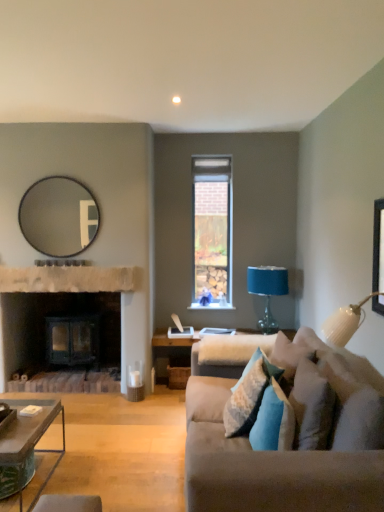
Where is `fur-like fabric ottoman at lower center`? fur-like fabric ottoman at lower center is located at coordinates (212, 353).

At what (x,y) coordinates should I click in order to perform the action: click on matte black mirror at upper left. Please return your answer as a coordinate pair (x, y). The width and height of the screenshot is (384, 512). Looking at the image, I should click on (59, 216).

The width and height of the screenshot is (384, 512). Describe the element at coordinates (212, 231) in the screenshot. I see `brick textured window at center` at that location.

Where is `textured blue pillow at center, arranged as the third pillow when viewed from the front`? textured blue pillow at center, arranged as the third pillow when viewed from the front is located at coordinates (248, 395).

What do you see at coordinates (248, 395) in the screenshot?
I see `textured blue pillow at center, arranged as the third pillow when viewed from the front` at bounding box center [248, 395].

Describe the element at coordinates (264, 367) in the screenshot. The image size is (384, 512). I see `blue textured pillow at center, positioned as the fourth pillow in front-to-back order` at that location.

What is the approximate height of black matte picture frame at upper right?

26.23 inches.

Describe the element at coordinates (31, 447) in the screenshot. I see `green textured coffee table at lower left` at that location.

The height and width of the screenshot is (512, 384). Find the location of `fur-like fabric ottoman at lower center`. fur-like fabric ottoman at lower center is located at coordinates (212, 353).

From the image's perspective, would you say blue velvet pillow at lower right, the 3th pillow from the back, is shown under black matte picture frame at upper right?

Indeed, from the image's perspective, blue velvet pillow at lower right, the 3th pillow from the back, is shown beneath black matte picture frame at upper right.

Locate an element on the screen. The width and height of the screenshot is (384, 512). picture frame located above the blue velvet pillow at lower right, which appears as the 2th pillow when viewed from the front (from the image's perspective) is located at coordinates (378, 246).

Is blue velvet pillow at lower right, the 3th pillow from the back, aimed at black matte picture frame at upper right?

No, blue velvet pillow at lower right, the 3th pillow from the back, is not aimed at black matte picture frame at upper right.

Is blue velvet pillow at lower right, the 3th pillow from the back, taller or shorter than black matte picture frame at upper right?

In the image, blue velvet pillow at lower right, the 3th pillow from the back, appears to be shorter than black matte picture frame at upper right.

Which object is positioned more to the right, textured blue pillow at center, acting as the second pillow starting from the back, or brick textured window at center?

Positioned to the right is textured blue pillow at center, acting as the second pillow starting from the back.

Between textured blue pillow at center, arranged as the third pillow when viewed from the front, and brick textured window at center, which one has less height?

→ With less height is textured blue pillow at center, arranged as the third pillow when viewed from the front.

Is textured blue pillow at center, acting as the second pillow starting from the back, positioned with its back to brick textured window at center?

No, textured blue pillow at center, acting as the second pillow starting from the back, is not facing away from brick textured window at center.

Looking at this image, from a real-world perspective, does textured blue pillow at center, acting as the second pillow starting from the back, sit lower than brick textured window at center?

Indeed, from a real-world perspective, textured blue pillow at center, acting as the second pillow starting from the back, is positioned beneath brick textured window at center.

Would you say blue velvet pillow at lower right, the 4th pillow positioned from the back, is a long distance from blue velvet pillow at lower right, which appears as the 2th pillow when viewed from the front?

No, blue velvet pillow at lower right, the 4th pillow positioned from the back, is in close proximity to blue velvet pillow at lower right, which appears as the 2th pillow when viewed from the front.

Which object is closer to the camera taking this photo, blue velvet pillow at lower right, the 1th pillow in the front-to-back sequence, or blue velvet pillow at lower right, the 3th pillow from the back?

blue velvet pillow at lower right, the 1th pillow in the front-to-back sequence, is closer to the camera.

How different are the orientations of blue velvet pillow at lower right, the 4th pillow positioned from the back, and blue velvet pillow at lower right, the 3th pillow from the back, in degrees?

The angular difference between blue velvet pillow at lower right, the 4th pillow positioned from the back, and blue velvet pillow at lower right, the 3th pillow from the back, is 0.000678 degrees.

This screenshot has height=512, width=384. Find the location of `studio couch that appears below the blue textured pillow at center, positioned as the fourth pillow in front-to-back order (from a real-world perspective)`. studio couch that appears below the blue textured pillow at center, positioned as the fourth pillow in front-to-back order (from a real-world perspective) is located at coordinates (292, 438).

Which of these two, velvet beige couch at right or blue textured pillow at center, the 1th pillow viewed from the back, is bigger?

Bigger between the two is velvet beige couch at right.

Does point (225, 433) appear closer or farther from the camera than point (265, 354)?

Point (225, 433) appears to be closer to the viewer than point (265, 354).

Could you tell me if blue velvet pillow at lower right, the 4th pillow positioned from the back, is facing fur-like fabric ottoman at lower center?

No, blue velvet pillow at lower right, the 4th pillow positioned from the back, is not turned towards fur-like fabric ottoman at lower center.

From the picture: How different are the orientations of blue velvet pillow at lower right, the 4th pillow positioned from the back, and fur-like fabric ottoman at lower center in degrees?

The angular difference between blue velvet pillow at lower right, the 4th pillow positioned from the back, and fur-like fabric ottoman at lower center is 6.26 degrees.

From a real-world perspective, is blue velvet pillow at lower right, the 4th pillow positioned from the back, located beneath fur-like fabric ottoman at lower center?

Incorrect, from a real-world perspective, blue velvet pillow at lower right, the 4th pillow positioned from the back, is higher than fur-like fabric ottoman at lower center.

Considering the positions of points (298, 362) and (219, 369), is point (298, 362) closer to camera compared to point (219, 369)?

Yes, point (298, 362) is closer to viewer.

Considering the relative positions of black matte picture frame at upper right and matte black mirror at upper left in the image provided, is black matte picture frame at upper right behind matte black mirror at upper left?

No, black matte picture frame at upper right is in front of matte black mirror at upper left.

From a real-world perspective, is black matte picture frame at upper right positioned above or below matte black mirror at upper left?

From a real-world perspective, black matte picture frame at upper right is physically below matte black mirror at upper left.

Can you tell me how much black matte picture frame at upper right and matte black mirror at upper left differ in facing direction?

They differ by 92.2 degrees in their facing directions.

Is black matte picture frame at upper right thinner than matte black mirror at upper left?

Indeed, black matte picture frame at upper right has a lesser width compared to matte black mirror at upper left.

Could you tell me if blue fabric-covered lampshade at right is turned towards textured blue pillow at center, acting as the second pillow starting from the back?

Yes, blue fabric-covered lampshade at right is facing textured blue pillow at center, acting as the second pillow starting from the back.

Locate an element on the screen. table lamp lying above the textured blue pillow at center, arranged as the third pillow when viewed from the front (from the image's perspective) is located at coordinates (267, 291).

Can you confirm if blue fabric-covered lampshade at right is wider than textured blue pillow at center, acting as the second pillow starting from the back?

Yes, blue fabric-covered lampshade at right is wider than textured blue pillow at center, acting as the second pillow starting from the back.

There is a black matte picture frame at upper right. Where is `the 3rd pillow below it (from a real-world perspective)`? The image size is (384, 512). the 3rd pillow below it (from a real-world perspective) is located at coordinates (273, 421).

Locate an element on the screen. This screenshot has height=512, width=384. pillow that is the 2nd object located in front of the brick textured window at center is located at coordinates (248, 395).

Which object lies further to the anchor point matte black mirror at upper left, rustic stone fireplace at center or blue velvet pillow at lower right, the 1th pillow in the front-to-back sequence?

Based on the image, blue velvet pillow at lower right, the 1th pillow in the front-to-back sequence, appears to be further to matte black mirror at upper left.

From the picture: Based on their spatial positions, is fur-like fabric ottoman at lower center or blue velvet pillow at lower right, which appears as the 2th pillow when viewed from the front, closer to velvet beige couch at right?

blue velvet pillow at lower right, which appears as the 2th pillow when viewed from the front.

Estimate the real-world distances between objects in this image. Which object is closer to matte black mirror at upper left, brick textured window at center or green textured coffee table at lower left?

Among the two, brick textured window at center is located nearer to matte black mirror at upper left.

Estimate the real-world distances between objects in this image. Which object is closer to fur-like fabric ottoman at lower center, blue velvet pillow at lower right, which appears as the 2th pillow when viewed from the front, or matte black mirror at upper left?

blue velvet pillow at lower right, which appears as the 2th pillow when viewed from the front, is positioned closer to the anchor fur-like fabric ottoman at lower center.

When comparing their distances from fur-like fabric ottoman at lower center, does black matte picture frame at upper right or textured blue pillow at center, arranged as the third pillow when viewed from the front, seem closer?

textured blue pillow at center, arranged as the third pillow when viewed from the front, lies closer to fur-like fabric ottoman at lower center than the other object.

When comparing their distances from matte black mirror at upper left, does rustic stone fireplace at center or blue textured pillow at center, the 1th pillow viewed from the back, seem closer?

Among the two, rustic stone fireplace at center is located nearer to matte black mirror at upper left.

Looking at the image, which one is located closer to blue velvet pillow at lower right, which appears as the 2th pillow when viewed from the front, textured blue pillow at center, acting as the second pillow starting from the back, or velvet beige couch at right?

Among the two, textured blue pillow at center, acting as the second pillow starting from the back, is located nearer to blue velvet pillow at lower right, which appears as the 2th pillow when viewed from the front.

When comparing their distances from velvet beige couch at right, does fur-like fabric ottoman at lower center or blue fabric-covered lampshade at right seem further?

blue fabric-covered lampshade at right lies further to velvet beige couch at right than the other object.

Where is `picture frame between velvet beige couch at right and fur-like fabric ottoman at lower center in the front-back direction`? The height and width of the screenshot is (512, 384). picture frame between velvet beige couch at right and fur-like fabric ottoman at lower center in the front-back direction is located at coordinates click(x=378, y=246).

This screenshot has width=384, height=512. I want to click on pillow situated between green textured coffee table at lower left and blue velvet pillow at lower right, which appears as the 2th pillow when viewed from the front, from left to right, so click(248, 395).

Image resolution: width=384 pixels, height=512 pixels. What are the coordinates of `picture frame positioned between velvet beige couch at right and brick textured window at center from near to far` in the screenshot? It's located at (378, 246).

Locate an element on the screen. The width and height of the screenshot is (384, 512). pillow situated between matte black mirror at upper left and fur-like fabric ottoman at lower center from left to right is located at coordinates (248, 395).